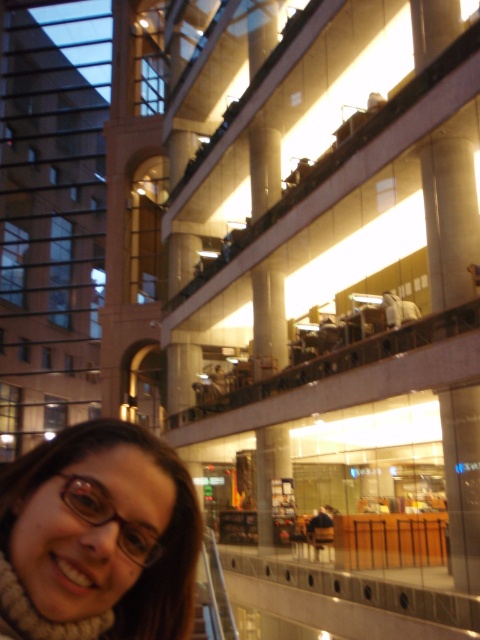
Consider the image. Measure the distance between beige knitted scarf at lower left and translucent plastic glasses at lower left.

beige knitted scarf at lower left is 15.71 inches away from translucent plastic glasses at lower left.

Is beige knitted scarf at lower left smaller than translucent plastic glasses at lower left?

No, beige knitted scarf at lower left is not smaller than translucent plastic glasses at lower left.

Describe the element at coordinates (98, 538) in the screenshot. I see `beige knitted scarf at lower left` at that location.

You are a GUI agent. You are given a task and a screenshot of the screen. Output one action in this format:
    pyautogui.click(x=<x>, y=<y>)
    Task: Click on the beige knitted scarf at lower left
    The width and height of the screenshot is (480, 640).
    Given the screenshot: What is the action you would take?
    pyautogui.click(x=98, y=538)